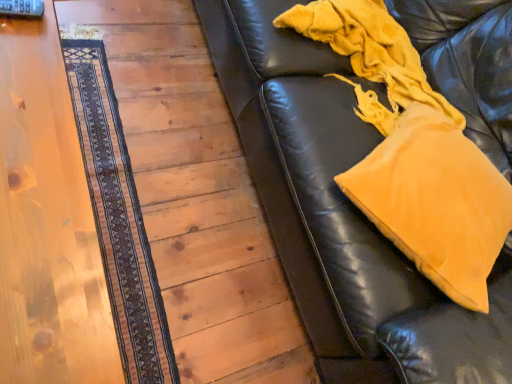
Locate an element on the screen. free space above wooden floor at lower left (from a real-world perspective) is located at coordinates (182, 181).